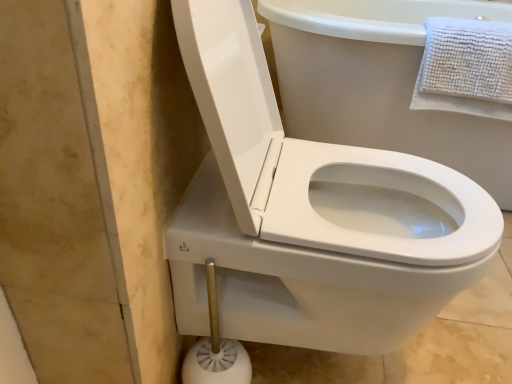
Question: Should I look upward or downward to see white plastic toilet brush at lower center?

Choices:
 (A) up
 (B) down

Answer: (B)

Question: Is the depth of white textured towel at upper right greater than that of white plastic toilet brush at lower center?

Choices:
 (A) no
 (B) yes

Answer: (B)

Question: Is white textured towel at upper right not close to white plastic toilet brush at lower center?

Choices:
 (A) yes
 (B) no

Answer: (B)

Question: Can we say white textured towel at upper right lies outside white plastic toilet brush at lower center?

Choices:
 (A) no
 (B) yes

Answer: (B)

Question: Does white textured towel at upper right have a lesser width compared to white plastic toilet brush at lower center?

Choices:
 (A) no
 (B) yes

Answer: (A)

Question: Can you confirm if white textured towel at upper right is bigger than white plastic toilet brush at lower center?

Choices:
 (A) yes
 (B) no

Answer: (A)

Question: Would you say white textured towel at upper right contains white plastic toilet brush at lower center?

Choices:
 (A) yes
 (B) no

Answer: (B)

Question: From a real-world perspective, is white glossy toilet at center located higher than white textured towel at upper right?

Choices:
 (A) yes
 (B) no

Answer: (B)

Question: Are white glossy toilet at center and white textured towel at upper right making contact?

Choices:
 (A) no
 (B) yes

Answer: (A)

Question: Is white glossy toilet at center in front of white textured towel at upper right?

Choices:
 (A) yes
 (B) no

Answer: (A)

Question: From the image's perspective, does white glossy toilet at center appear higher than white textured towel at upper right?

Choices:
 (A) yes
 (B) no

Answer: (B)

Question: Is white textured towel at upper right located within white glossy toilet at center?

Choices:
 (A) yes
 (B) no

Answer: (B)

Question: Would you say white glossy toilet at center is outside white textured towel at upper right?

Choices:
 (A) no
 (B) yes

Answer: (B)

Question: Does white plastic toilet brush at lower center appear on the right side of white textured towel at upper right?

Choices:
 (A) yes
 (B) no

Answer: (B)